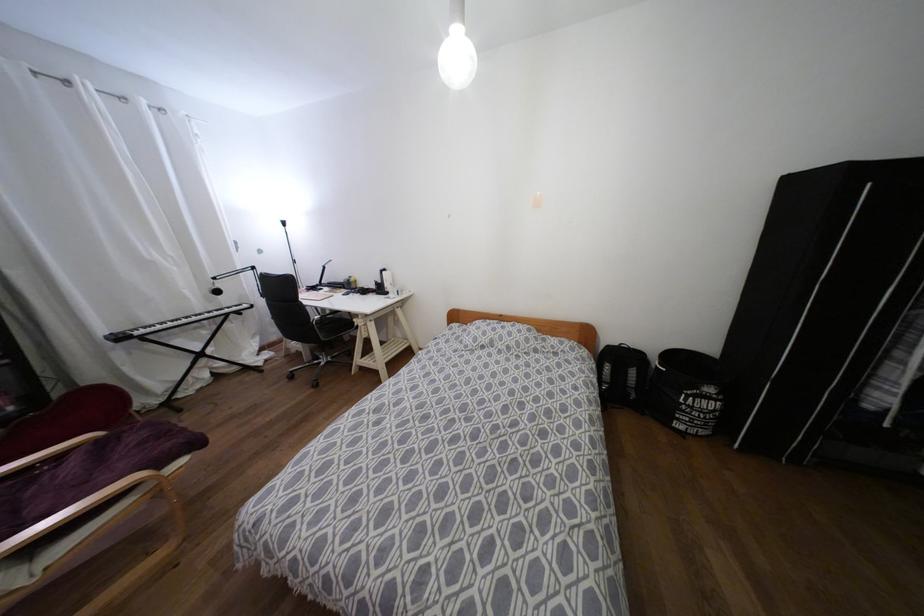
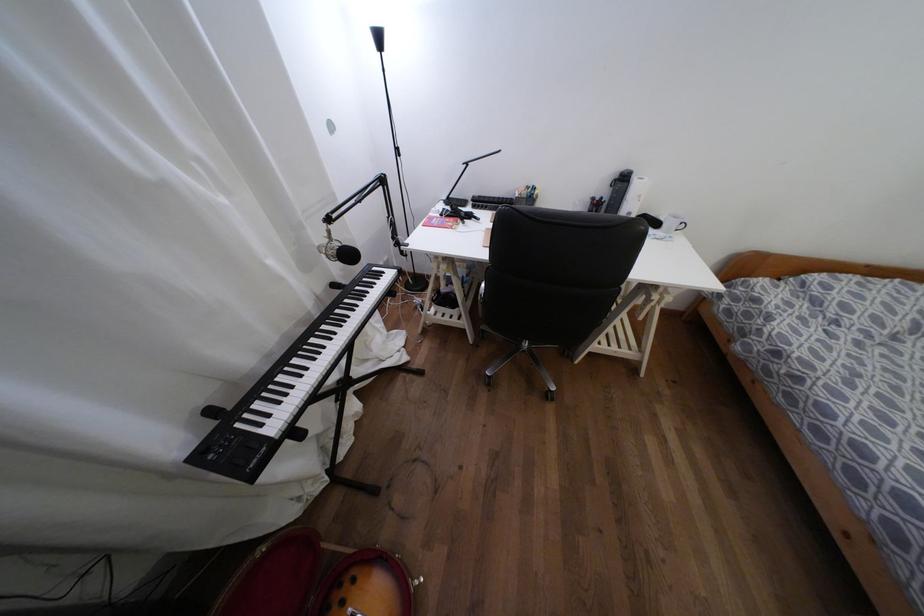
In the scene shown: The images are taken continuously from a first-person perspective. In which direction are you moving?

The cameraman moved toward left, forward.